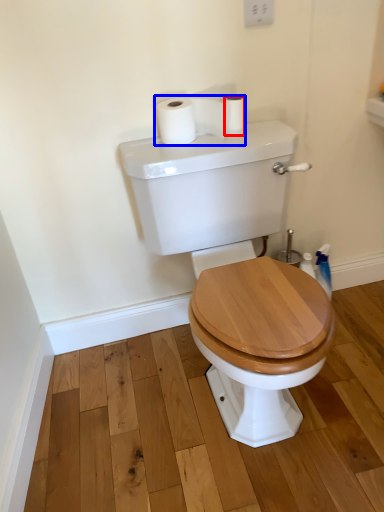
Question: Among these objects, which one is nearest to the camera, toilet paper (highlighted by a red box) or toilet paper (highlighted by a blue box)?

Choices:
 (A) toilet paper
 (B) toilet paper

Answer: (B)